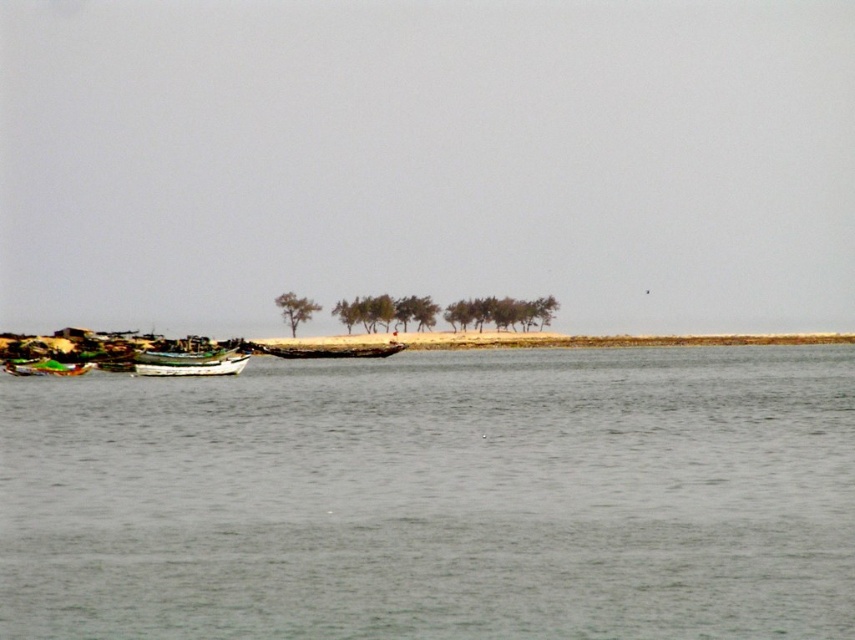
You are standing on the beach and want to take a photo of both the clear water at center and the green matte tree at center. Which object should you zoom in on more to ensure both are in focus?

You should zoom in more on the green matte tree at center because it is taller than the clear water at center, so adjusting focus for the taller object will help both be in focus.

In the scene shown: You are a photographer planning to capture the entire scene including the clear water at center and the wooden boat at center. Given that your camera has a fixed focal length, which object should you prioritize framing closer to ensure both fit in the shot?

Since the clear water at center is wider than the wooden boat at center, you should prioritize framing the wooden boat at center closer to ensure both fit in the shot.

You are standing on the beach and want to walk to the wooden boat at center. The clear water at center is between you and the boat. Is the water deeper than the boat?

The clear water at center is much taller than the wooden boat at center, so yes, the water is deeper than the boat.